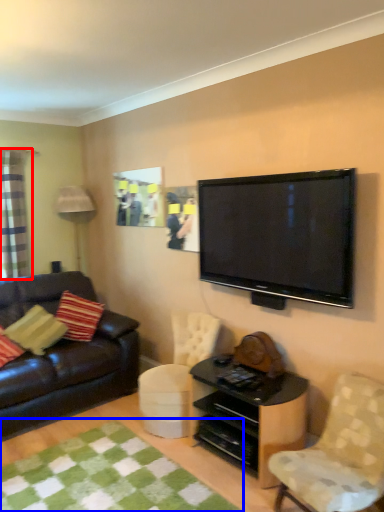
Question: Which of the following is the farthest to the observer, curtain (highlighted by a red box) or mat (highlighted by a blue box)?

Choices:
 (A) curtain
 (B) mat

Answer: (A)